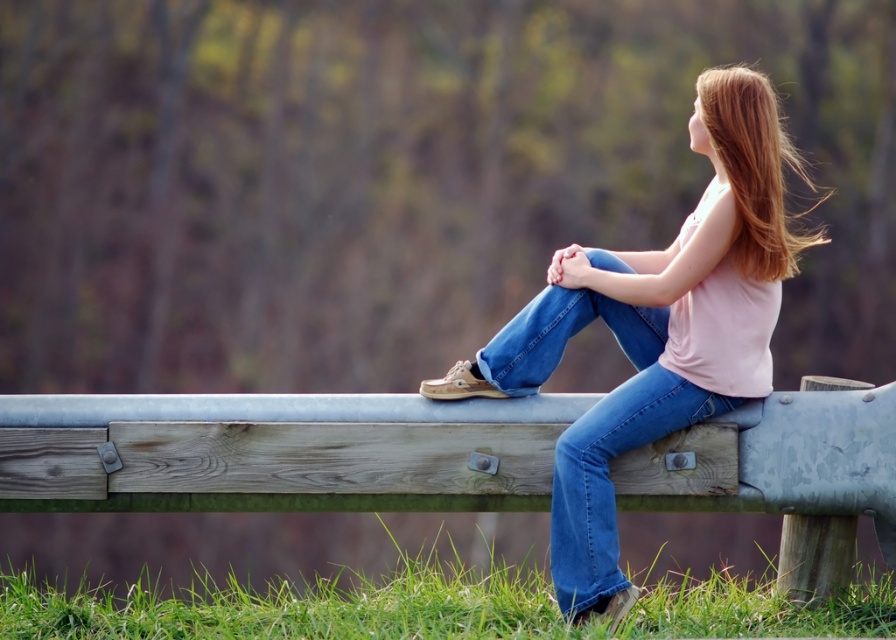
Does wooden bench at center have a greater width compared to denim jeans at center?

Yes, wooden bench at center is wider than denim jeans at center.

Is wooden bench at center above denim jeans at center?

Actually, wooden bench at center is below denim jeans at center.

Which is in front, point (558, 429) or point (552, 576)?

Positioned in front is point (552, 576).

Identify the location of wooden bench at center. (276, 451).

Which is behind, point (507, 349) or point (747, 108)?

Point (507, 349)

Is point (593, 436) closer to camera compared to point (797, 268)?

Yes, it is.

The width and height of the screenshot is (896, 640). What do you see at coordinates (593, 424) in the screenshot?
I see `blue denim jeans at center` at bounding box center [593, 424].

Identify the location of blue denim jeans at center. (593, 424).

Does wooden bench at center lie behind shiny brown hair at upper right?

Yes, wooden bench at center is behind shiny brown hair at upper right.

Does wooden bench at center have a smaller size compared to shiny brown hair at upper right?

No, wooden bench at center is not smaller than shiny brown hair at upper right.

Is point (860, 476) more distant than point (714, 83)?

Yes, it is behind point (714, 83).

This screenshot has height=640, width=896. Find the location of `wooden bench at center`. wooden bench at center is located at coordinates (276, 451).